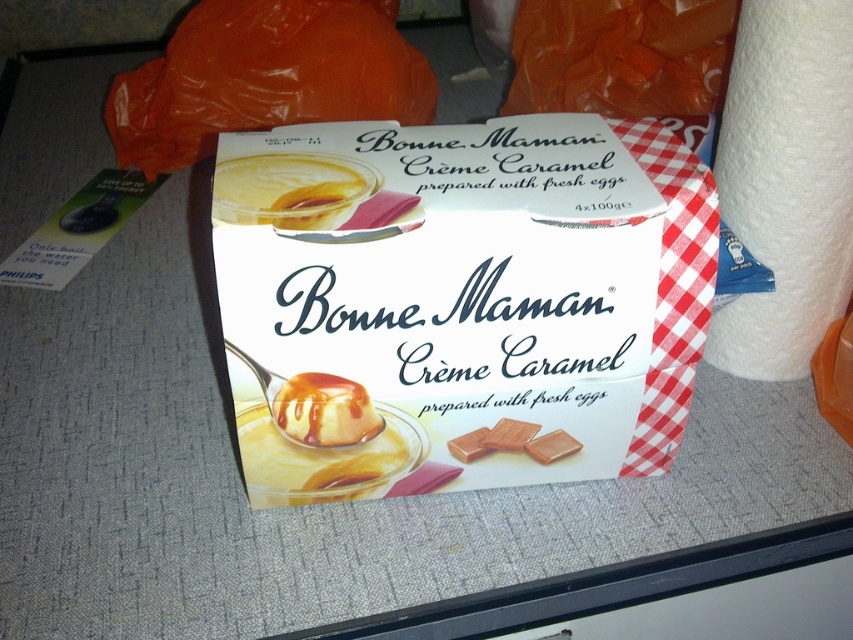
Question: Is white paper towel at right smaller than yellow creamy pudding at center?

Choices:
 (A) yes
 (B) no

Answer: (B)

Question: Can you confirm if white paper towel at right is positioned above white glossy creme caramel at center?

Choices:
 (A) no
 (B) yes

Answer: (B)

Question: Which of the following is the closest to the observer?

Choices:
 (A) white paper towel at right
 (B) white glossy creme caramel at center

Answer: (A)

Question: Does white paper towel at right lie in front of yellow creamy pudding at center?

Choices:
 (A) yes
 (B) no

Answer: (B)

Question: Which point is closer to the camera taking this photo?

Choices:
 (A) (283, 182)
 (B) (343, 442)
 (C) (795, 35)

Answer: (A)

Question: Based on their relative distances, which object is farther from the yellow creamy pudding at center?

Choices:
 (A) white paper towel at right
 (B) white glossy creme caramel at center

Answer: (A)